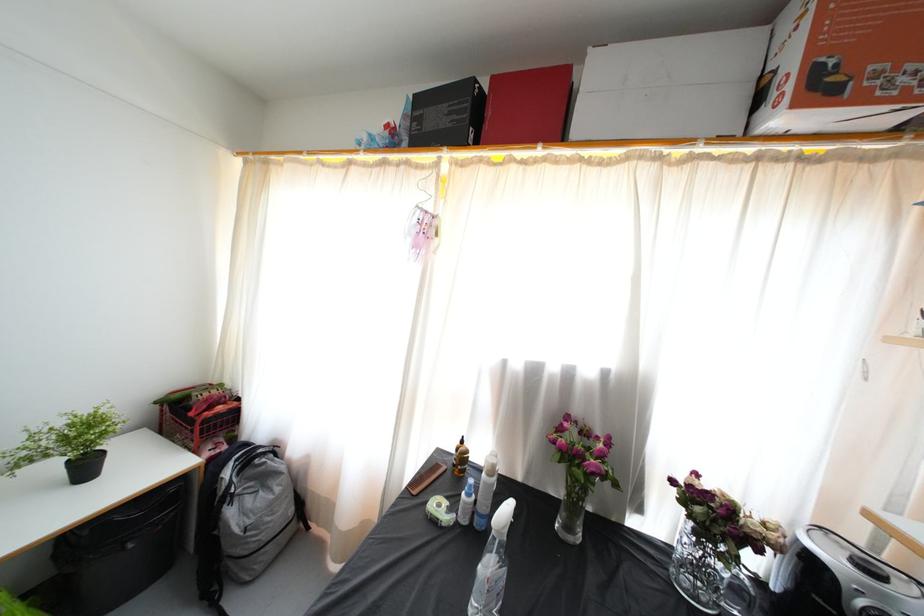
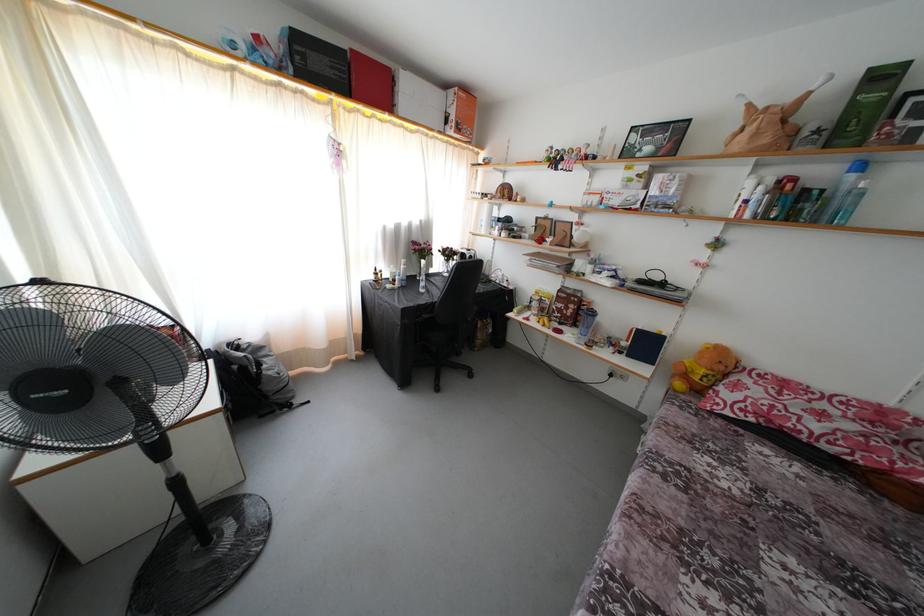
Find the pixel in the second image that matches point (827, 94) in the first image.

(463, 134)